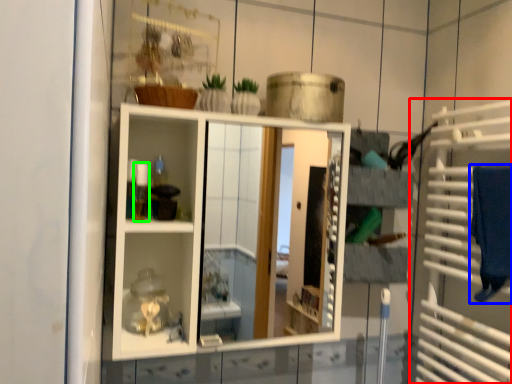
Question: Considering the real-world distances, which object is farthest from cage (highlighted by a red box)? bath towel (highlighted by a blue box) or toiletry (highlighted by a green box)?

Choices:
 (A) bath towel
 (B) toiletry

Answer: (B)